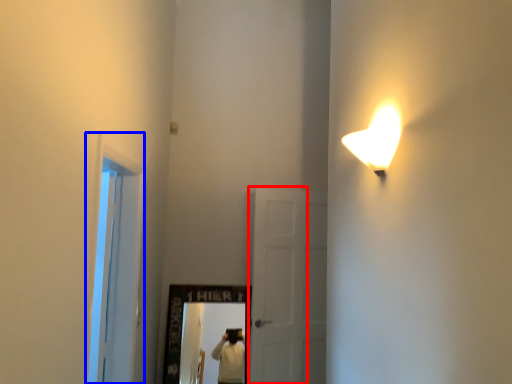
Question: Which of the following is the farthest to the observer, door (highlighted by a red box) or window (highlighted by a blue box)?

Choices:
 (A) door
 (B) window

Answer: (A)